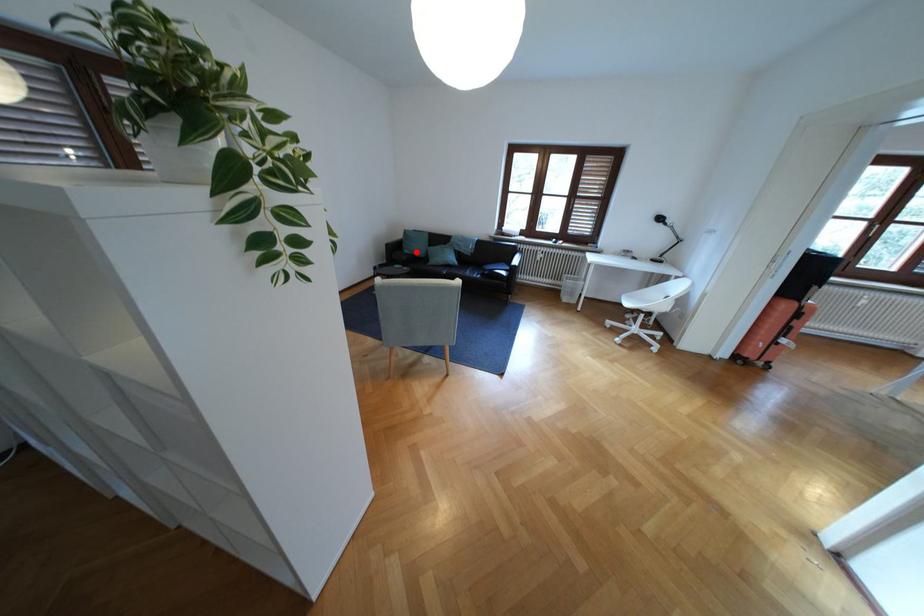
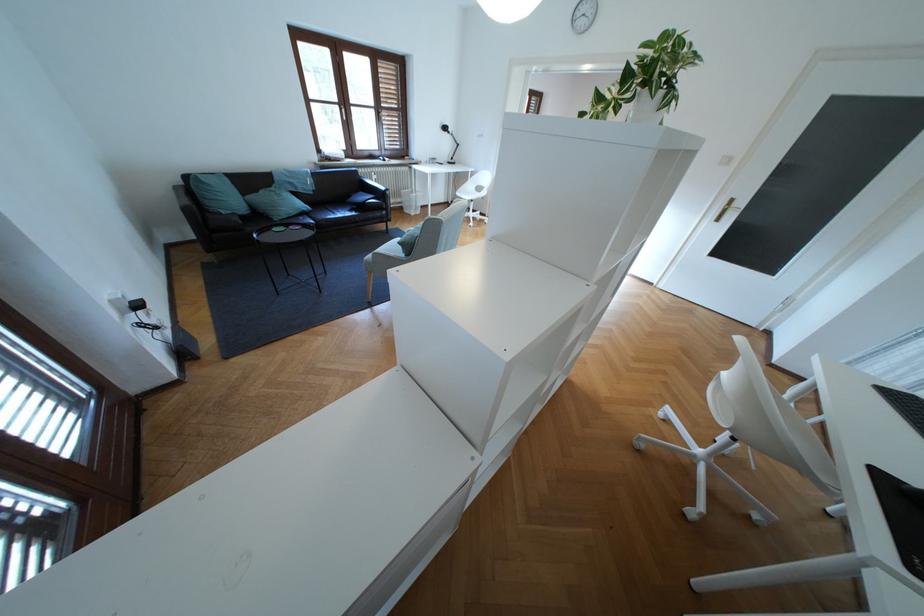
Question: I am providing you with two images of the same scene from different viewpoints. Image1 has a red point marked. In image2, the corresponding 3D location appears at what relative position? Reply with the corresponding letter.

Choices:
 (A) Closer
 (B) Farther

Answer: (A)